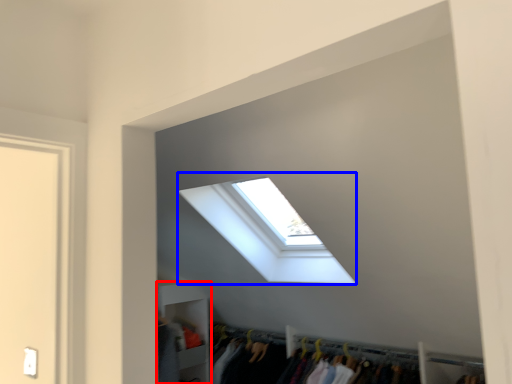
Question: Among these objects, which one is farthest to the camera, shelf (highlighted by a red box) or window (highlighted by a blue box)?

Choices:
 (A) shelf
 (B) window

Answer: (A)